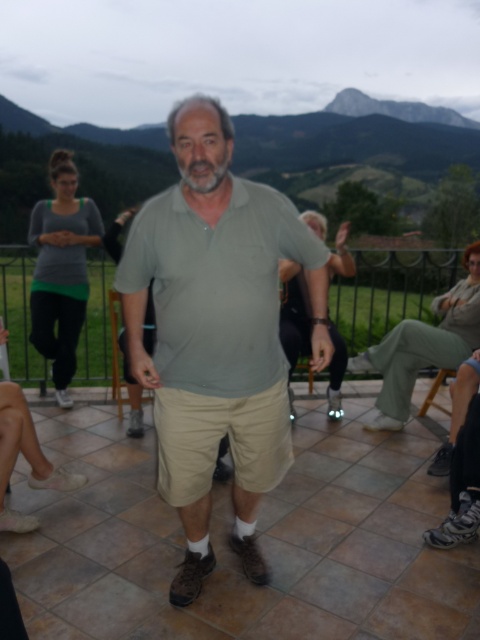
You are a photographer trying to capture a photo of the matte green shirt at center and the rocky gray mountain at upper center in the same frame. Given that your camera has a maximum focus range of 18 meters, will both objects be in focus?

The matte green shirt at center is 18.44 meters away from the rocky gray mountain at upper center. Since the camera can only focus up to 18 meters, the distance between them exceeds the focus range, so both objects cannot be in focus simultaneously.

You are an observer standing on the patio looking at the scene. You notice the matte green shirt at center and the khaki pants at lower right. Which object appears bigger in the image?

The matte green shirt at center appears bigger than the khaki pants at lower right in the image.